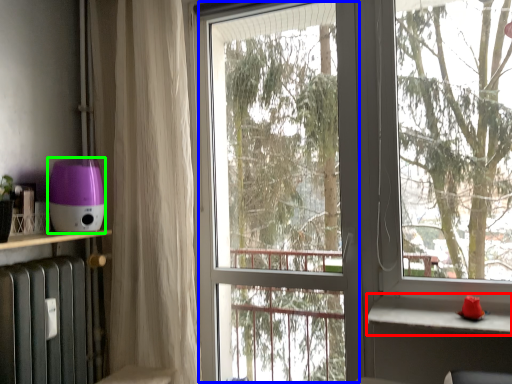
Question: Which is nearer to the window sill (highlighted by a red box)? screen door (highlighted by a blue box) or appliance (highlighted by a green box).

Choices:
 (A) screen door
 (B) appliance

Answer: (B)